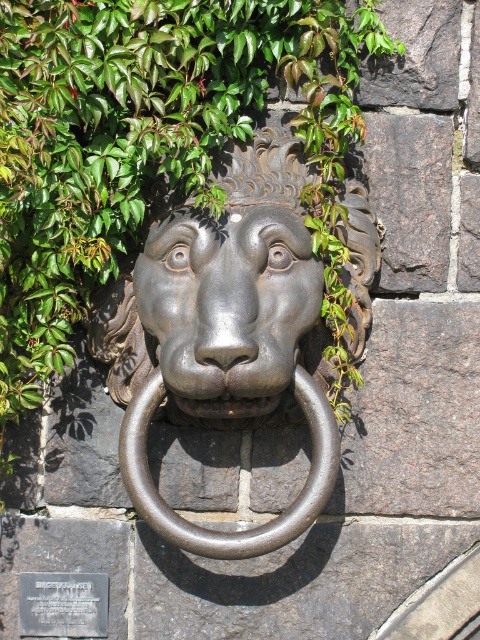
Question: Observing the image, what is the correct spatial positioning of green leafy plant at center in reference to bronze metallic ring at center?

Choices:
 (A) left
 (B) right

Answer: (A)

Question: Can you confirm if bronze metallic ring at center is wider than silver metallic plaque at lower left?

Choices:
 (A) yes
 (B) no

Answer: (A)

Question: Which object is farther from the camera taking this photo?

Choices:
 (A) silver metallic plaque at lower left
 (B) bronze metallic ring at center

Answer: (A)

Question: Which point is closer to the camera?

Choices:
 (A) bronze metallic ring at center
 (B) green leafy plant at center
 (C) matte bronze lion head at center

Answer: (B)

Question: Which point is closer to the camera?

Choices:
 (A) bronze metallic ring at center
 (B) matte bronze lion head at center
 (C) green leafy plant at center
 (D) silver metallic plaque at lower left

Answer: (C)

Question: Does green leafy plant at center lie behind silver metallic plaque at lower left?

Choices:
 (A) yes
 (B) no

Answer: (B)